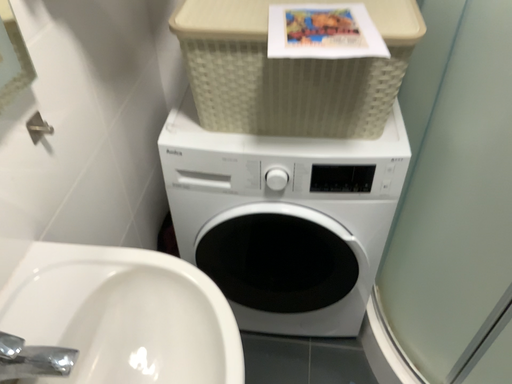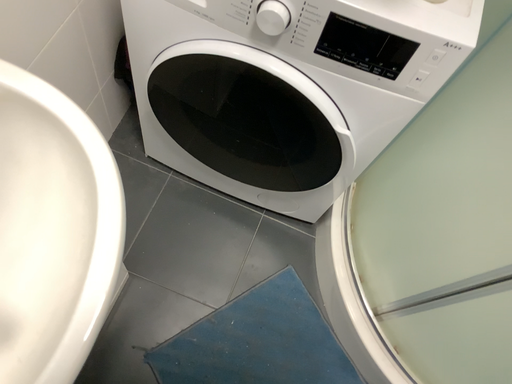
Question: Which way did the camera rotate in the video?

Choices:
 (A) rotated upward
 (B) rotated downward

Answer: (B)